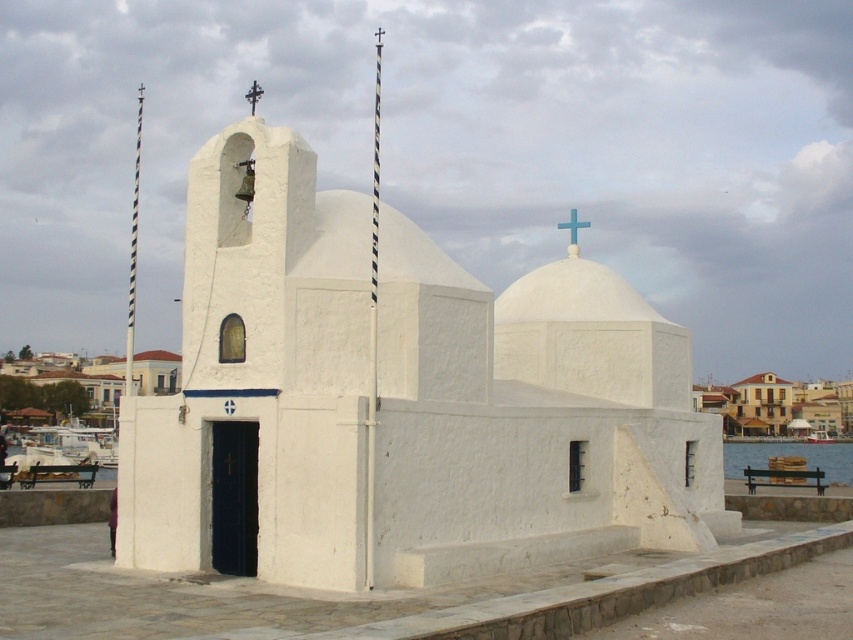
You are standing at the point with coordinates point (399, 400). What structure are you directly facing?

The point (399, 400) corresponds to the white matte chapel at center, so you are directly facing the white matte chapel at center.

You are standing in front of the waterfront and notice the white matte chapel at center and the blue plastic cross at upper center. Which object is positioned higher in the image?

The white matte chapel at center is located above the blue plastic cross at upper center, so the chapel is higher in the image.

You are an architect designing a model of the church and need to ensure scale accuracy. Given that the blue plastic cross at upper center must be proportionally smaller than the white matte chapel at center in your model, which object should you prioritize scaling down first?

The blue plastic cross at upper center should be scaled down first since it is already smaller in size than the white matte chapel at center in the original image, so maintaining its proportion requires careful reduction to match the chapel scale.